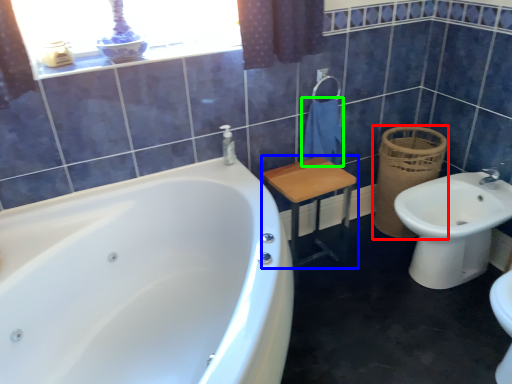
Question: Based on their relative distances, which object is farther from basket (highlighted by a red box)? Choose from furniture (highlighted by a blue box) and bath towel (highlighted by a green box).

Choices:
 (A) furniture
 (B) bath towel

Answer: (A)